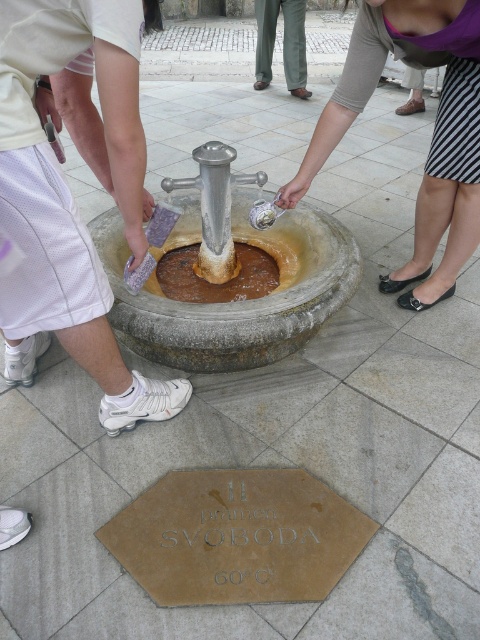
Question: Which object is positioned farthest from the brown stone fountain at center?

Choices:
 (A) white mesh shorts at lower left
 (B) green fabric pants at center
 (C) striped skirt at lower right

Answer: (B)

Question: Can you confirm if brown stone fountain at center is bigger than green fabric pants at center?

Choices:
 (A) no
 (B) yes

Answer: (A)

Question: Which of these objects is positioned closest to the brown stone fountain at center?

Choices:
 (A) striped skirt at lower right
 (B) green fabric pants at center

Answer: (A)

Question: Does striped skirt at lower right appear on the right side of green fabric pants at center?

Choices:
 (A) yes
 (B) no

Answer: (A)

Question: Among these objects, which one is farthest from the camera?

Choices:
 (A) green fabric pants at center
 (B) striped skirt at lower right
 (C) matte stone fountain at center

Answer: (A)

Question: Where is matte stone fountain at center located in relation to green fabric pants at center in the image?

Choices:
 (A) right
 (B) left

Answer: (B)